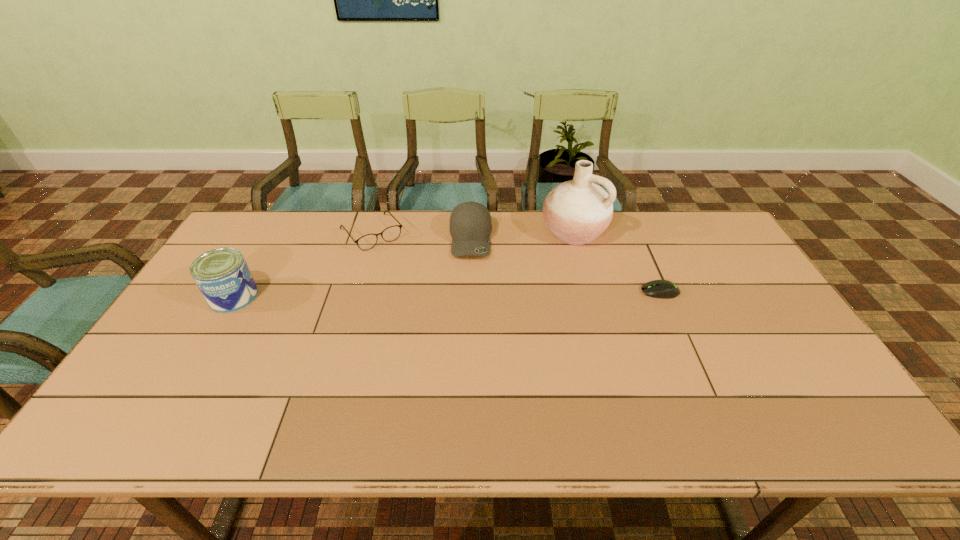
The height and width of the screenshot is (540, 960). I want to click on blank area located on the wheel side of the rightmost object, so click(542, 292).

The image size is (960, 540). Identify the location of free spot located 0.350m on the wheel side of the rightmost object. (521, 292).

You are a GUI agent. You are given a task and a screenshot of the screen. Output one action in this format:
    pyautogui.click(x=<x>, y=<y>)
    Task: Click on the free space located on the front brim of the third object from left to right
    The height and width of the screenshot is (540, 960).
    Given the screenshot: What is the action you would take?
    pyautogui.click(x=473, y=295)

Where is `vacant space located 0.380m on the front brim of the third object from left to right`? vacant space located 0.380m on the front brim of the third object from left to right is located at coordinates (478, 358).

I want to click on free spot located 0.200m on the front brim of the third object from left to right, so click(x=474, y=307).

I want to click on vacant point located on the front-facing side of the spectacles, so click(393, 260).

At what (x,y) coordinates should I click in order to perform the action: click on free location located on the front-facing side of the spectacles. Please return your answer as a coordinate pair (x, y). This screenshot has width=960, height=540. Looking at the image, I should click on (393, 260).

Identify the location of vacant region located on the front-facing side of the spectacles. (437, 316).

Where is `vacant region located 0.120m to pour from the handle of the fourth object from left to right`? vacant region located 0.120m to pour from the handle of the fourth object from left to right is located at coordinates [536, 266].

Locate an element on the screen. The width and height of the screenshot is (960, 540). vacant space located 0.330m to pour from the handle of the fourth object from left to right is located at coordinates (495, 303).